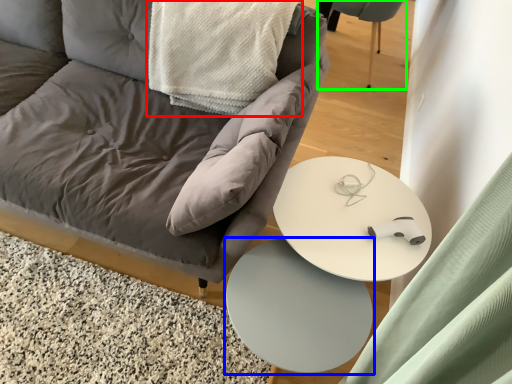
Question: Which is farther away from material (highlighted by a red box)? table (highlighted by a blue box) or swivel chair (highlighted by a green box)?

Choices:
 (A) table
 (B) swivel chair

Answer: (B)